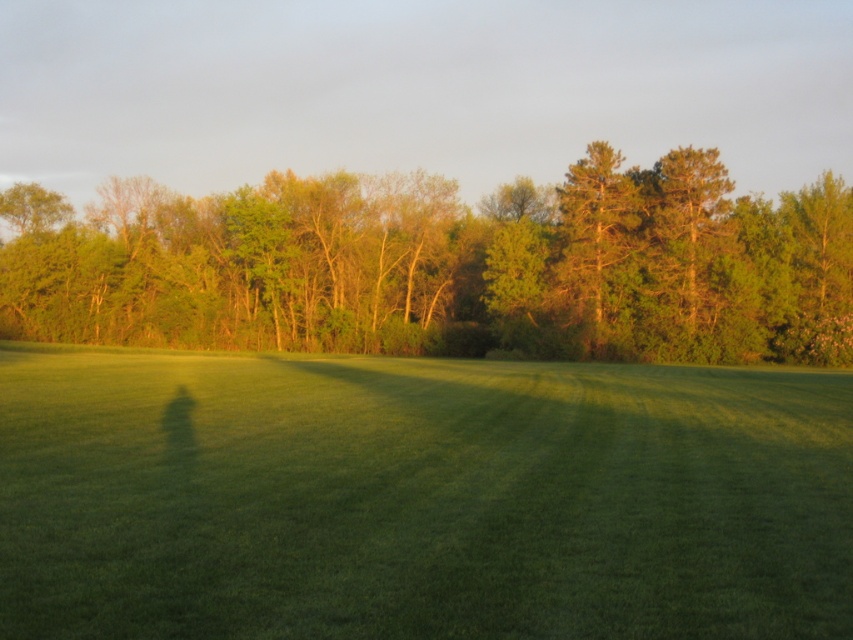
Does point (216, 337) lie behind point (610, 237)?

Yes, point (216, 337) is farther from viewer.

Does green leafy forest at upper center come in front of green textured tree at center?

Yes, green leafy forest at upper center is in front of green textured tree at center.

Is point (4, 285) positioned behind point (595, 234)?

Yes, it is behind point (595, 234).

Identify the location of green leafy forest at upper center. (444, 266).

Is green grass at center above green leafy forest at upper center?

Incorrect, green grass at center is not positioned above green leafy forest at upper center.

Does green grass at center lie in front of green leafy forest at upper center?

Yes.

Which is in front, point (705, 420) or point (396, 244)?

Positioned in front is point (705, 420).

The height and width of the screenshot is (640, 853). What are the coordinates of `green grass at center` in the screenshot? It's located at (418, 497).

Between point (370, 477) and point (606, 154), which one is positioned in front?

Positioned in front is point (370, 477).

Consider the image. Is green grass at center thinner than green textured tree at center?

Incorrect, green grass at center's width is not less than green textured tree at center's.

The width and height of the screenshot is (853, 640). Describe the element at coordinates (418, 497) in the screenshot. I see `green grass at center` at that location.

You are a GUI agent. You are given a task and a screenshot of the screen. Output one action in this format:
    pyautogui.click(x=<x>, y=<y>)
    Task: Click on the green grass at center
    The width and height of the screenshot is (853, 640).
    Given the screenshot: What is the action you would take?
    pyautogui.click(x=418, y=497)